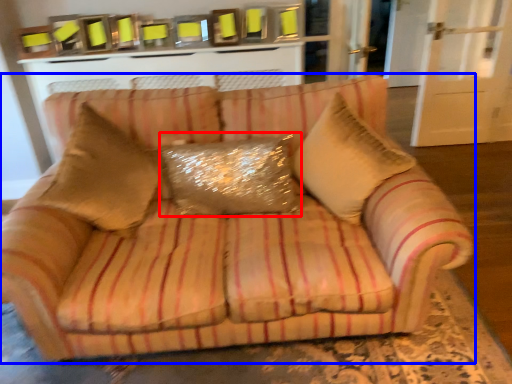
Question: Among these objects, which one is farthest to the camera, pillow (highlighted by a red box) or studio couch (highlighted by a blue box)?

Choices:
 (A) pillow
 (B) studio couch

Answer: (A)